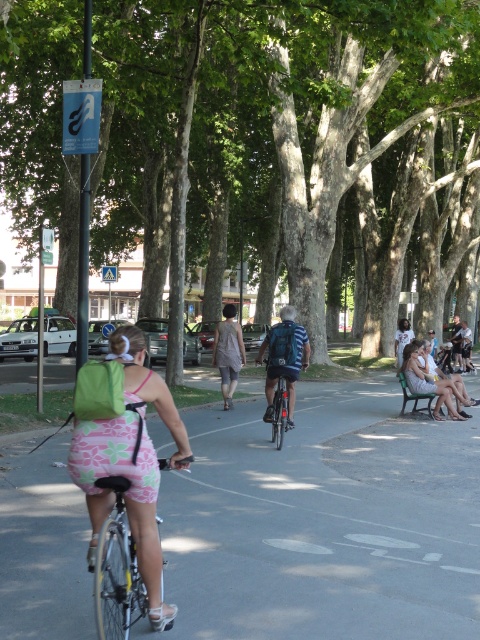
Question: In this image, where is light pink fabric dress at lower right located relative to shiny metallic bicycle at center?

Choices:
 (A) above
 (B) below

Answer: (A)

Question: Is green leafy tree at center to the left of green fabric backpack at left from the viewer's perspective?

Choices:
 (A) yes
 (B) no

Answer: (A)

Question: Which object is positioned farthest from the shiny metallic bicycle at center?

Choices:
 (A) green plastic bench at lower right
 (B) blue fabric backpack at center
 (C) pink fabric bicycle at center
 (D) green leafy tree at center

Answer: (D)

Question: Is green fabric backpack at left smaller than shiny metallic bicycle at center?

Choices:
 (A) yes
 (B) no

Answer: (B)

Question: Which point is farther to the camera?

Choices:
 (A) (454, 387)
 (B) (153, 387)

Answer: (A)

Question: Which point is closer to the camera?

Choices:
 (A) (425, 372)
 (B) (259, 356)

Answer: (B)